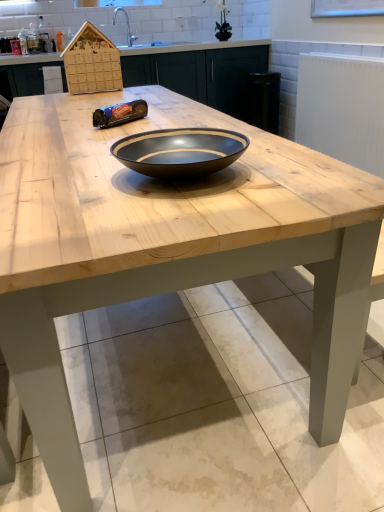
Question: Considering the relative sizes of black glossy bowl at center and white textured radiator at upper right in the image provided, is black glossy bowl at center taller than white textured radiator at upper right?

Choices:
 (A) yes
 (B) no

Answer: (B)

Question: Is black glossy bowl at center at the left side of white textured radiator at upper right?

Choices:
 (A) no
 (B) yes

Answer: (B)

Question: Could you tell me if black glossy bowl at center is facing white textured radiator at upper right?

Choices:
 (A) yes
 (B) no

Answer: (B)

Question: From the image's perspective, does black glossy bowl at center appear lower than white textured radiator at upper right?

Choices:
 (A) yes
 (B) no

Answer: (A)

Question: Is black glossy bowl at center wider than white textured radiator at upper right?

Choices:
 (A) no
 (B) yes

Answer: (B)

Question: Can you confirm if black glossy bowl at center is positioned to the right of white textured radiator at upper right?

Choices:
 (A) no
 (B) yes

Answer: (A)

Question: Can you confirm if wooden cabinetry at center is thinner than white textured radiator at upper right?

Choices:
 (A) no
 (B) yes

Answer: (A)

Question: From the image's perspective, is wooden cabinetry at center located above white textured radiator at upper right?

Choices:
 (A) no
 (B) yes

Answer: (B)

Question: Is wooden cabinetry at center smaller than white textured radiator at upper right?

Choices:
 (A) yes
 (B) no

Answer: (B)

Question: From a real-world perspective, is wooden cabinetry at center beneath white textured radiator at upper right?

Choices:
 (A) no
 (B) yes

Answer: (A)

Question: Does wooden cabinetry at center come in front of white textured radiator at upper right?

Choices:
 (A) yes
 (B) no

Answer: (B)

Question: Can you confirm if wooden cabinetry at center is positioned to the left of white textured radiator at upper right?

Choices:
 (A) yes
 (B) no

Answer: (A)

Question: Considering the relative sizes of white textured radiator at upper right and black glossy bowl at center in the image provided, is white textured radiator at upper right thinner than black glossy bowl at center?

Choices:
 (A) no
 (B) yes

Answer: (B)